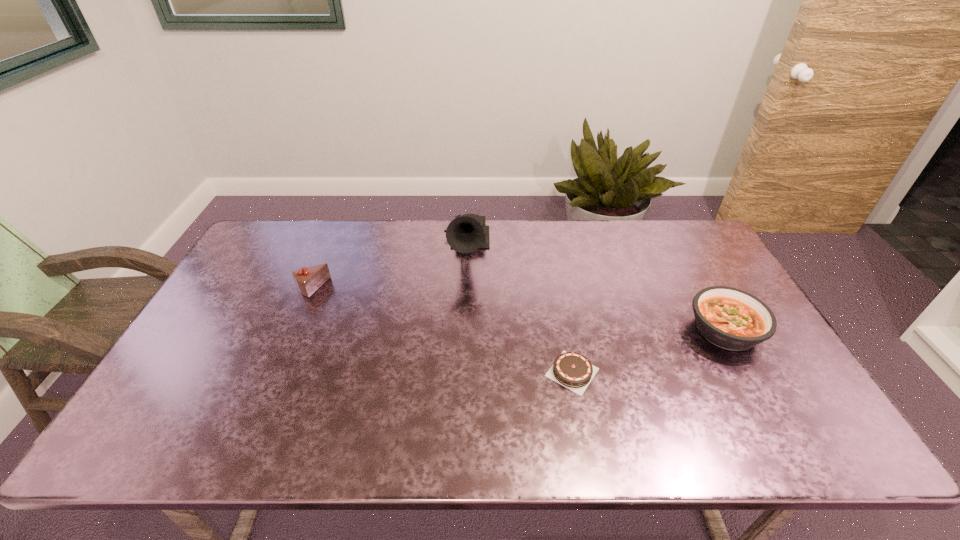
Find the location of `free space located on the right of the right chocolate cake`. free space located on the right of the right chocolate cake is located at coordinates (690, 372).

This screenshot has width=960, height=540. Find the location of `object that is at the far edge`. object that is at the far edge is located at coordinates (466, 233).

Where is `object located at the right edge`? This screenshot has width=960, height=540. object located at the right edge is located at coordinates (732, 319).

At what (x,y) coordinates should I click in order to perform the action: click on vacant space at the far edge of the desktop. Please return your answer as a coordinate pair (x, y). Looking at the image, I should click on (413, 245).

At what (x,y) coordinates should I click in order to perform the action: click on free space at the near edge of the desktop. Please return your answer as a coordinate pair (x, y). This screenshot has height=540, width=960. Looking at the image, I should click on (362, 446).

Identify the location of blank space at the left edge. (153, 400).

Where is `vacant region at the right edge of the desktop`? The height and width of the screenshot is (540, 960). vacant region at the right edge of the desktop is located at coordinates (812, 410).

The image size is (960, 540). In the image, there is a desktop. In order to click on vacant space at the far left corner in this screenshot , I will do `click(264, 240)`.

What are the coordinates of `free location at the near left corner` in the screenshot? It's located at (180, 419).

Where is `free space between the rightmost object and the taller chocolate cake`? free space between the rightmost object and the taller chocolate cake is located at coordinates [518, 309].